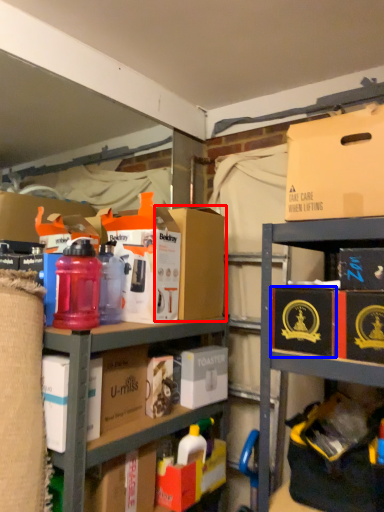
Question: Which of the following is the closest to the observer, cardboard box (highlighted by a red box) or cardboard box (highlighted by a blue box)?

Choices:
 (A) cardboard box
 (B) cardboard box

Answer: (B)